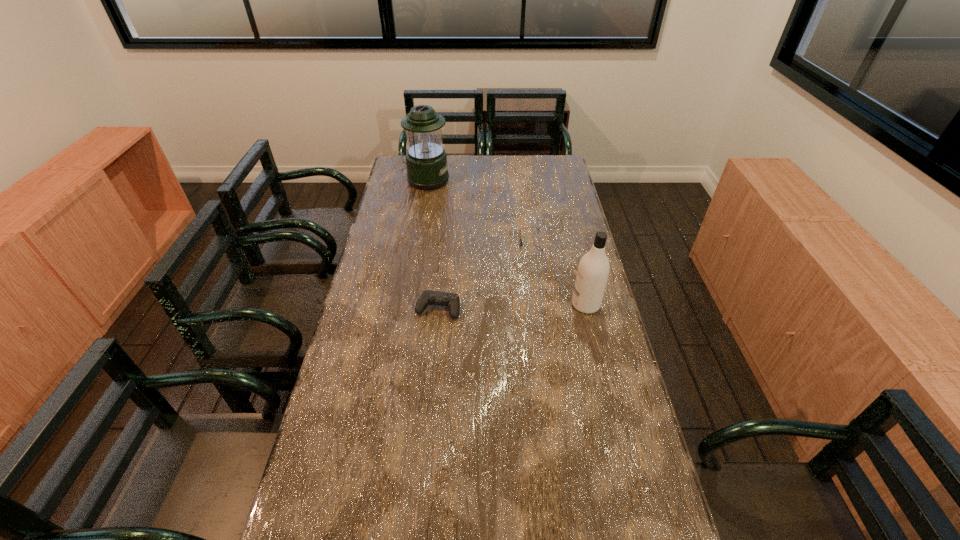
You are a GUI agent. You are given a task and a screenshot of the screen. Output one action in this format:
    pyautogui.click(x=<x>, y=<y>)
    Task: Click on the free point between the sunglasses and the control
    The image size is (960, 540).
    Given the screenshot: What is the action you would take?
    pyautogui.click(x=484, y=275)

The width and height of the screenshot is (960, 540). What are the coordinates of `vacant region between the shortest object and the second shortest object` in the screenshot? It's located at (484, 275).

Identify the location of vacant space in between the lantern and the third shortest object. (506, 242).

Locate an element on the screen. free space between the control and the shampoo is located at coordinates (512, 307).

I want to click on object that is the third closest one to the second shortest object, so click(426, 162).

Find the location of `object identified as the third closest to the farthest object`. object identified as the third closest to the farthest object is located at coordinates (593, 270).